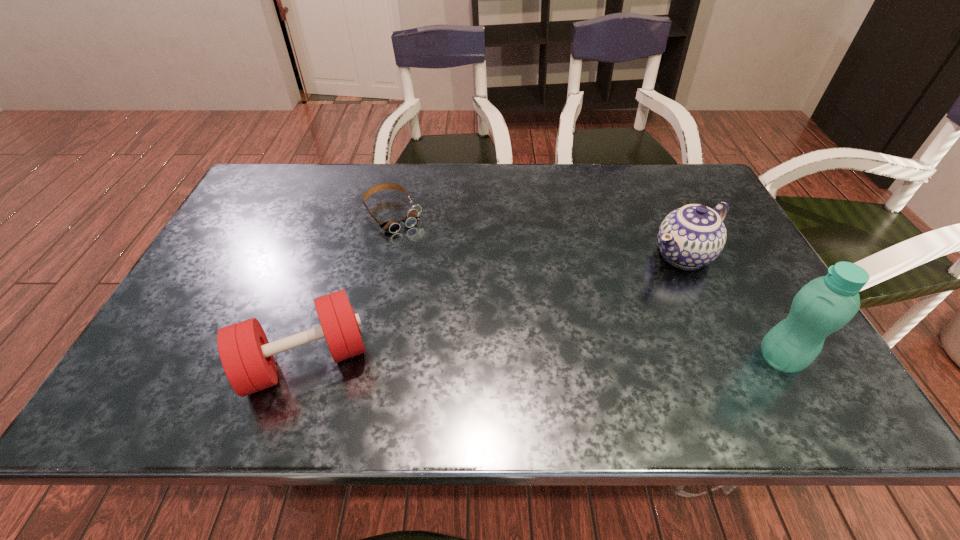
You are a GUI agent. You are given a task and a screenshot of the screen. Output one action in this format:
    pyautogui.click(x=<x>, y=<y>)
    Task: Click on the free spot on the desktop that is between the dumbbell and the tallest object and is positioned on the front-facing side of the shortest object
    
    Given the screenshot: What is the action you would take?
    pyautogui.click(x=500, y=360)

Where is `vacant space on the desktop that is between the dumbbell and the bottle and is positioned at the spout of the chinaware`? This screenshot has width=960, height=540. vacant space on the desktop that is between the dumbbell and the bottle and is positioned at the spout of the chinaware is located at coordinates (506, 360).